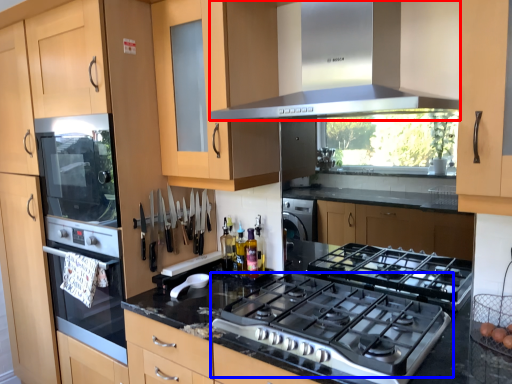
Question: Which object appears farthest to the camera in this image, home appliance (highlighted by a red box) or gas stove (highlighted by a blue box)?

Choices:
 (A) home appliance
 (B) gas stove

Answer: (B)